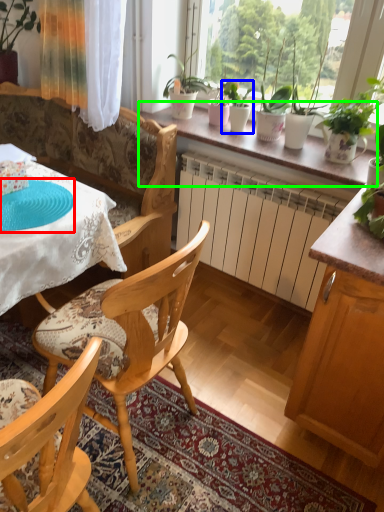
Question: Which object is the farthest from paper plate (highlighted by a red box)? Choose among these: houseplant (highlighted by a blue box) or window sill (highlighted by a green box).

Choices:
 (A) houseplant
 (B) window sill

Answer: (A)